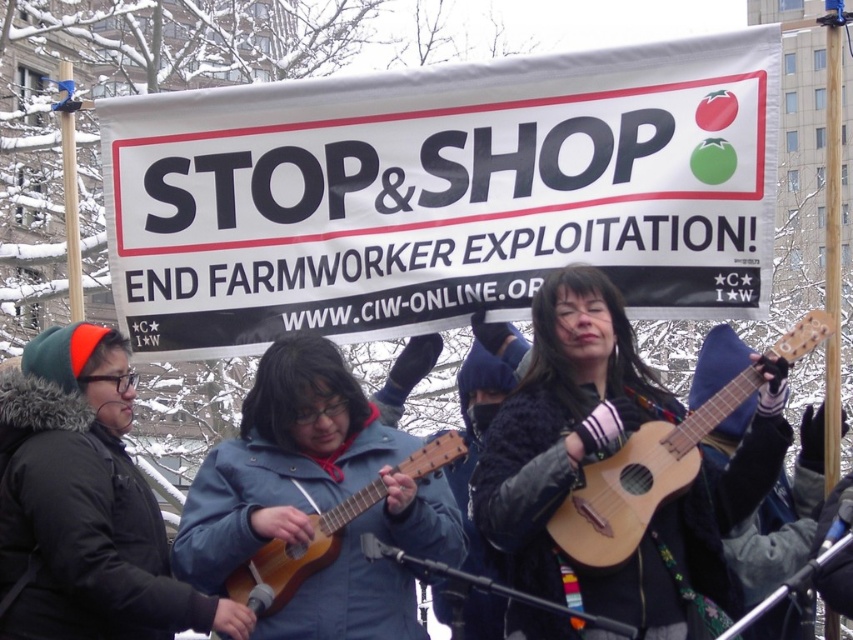
Find the location of a particular element. dark green fur-lined jacket at left is located at coordinates (x=86, y=502).

Is dark green fur-lined jacket at left behind wooden acoustic guitar at center?

No, it is in front of wooden acoustic guitar at center.

Who is more distant from viewer, [112,545] or [376,500]?

Positioned behind is point [376,500].

The width and height of the screenshot is (853, 640). I want to click on dark green fur-lined jacket at left, so [x=86, y=502].

Does light brown wooden guitar at center appear on the right side of wooden acoustic guitar at center?

Indeed, light brown wooden guitar at center is positioned on the right side of wooden acoustic guitar at center.

Does light brown wooden guitar at center appear over wooden acoustic guitar at center?

Yes, light brown wooden guitar at center is above wooden acoustic guitar at center.

Describe the element at coordinates (639, 480) in the screenshot. I see `light brown wooden guitar at center` at that location.

Find the location of a particular element. light brown wooden guitar at center is located at coordinates (639, 480).

From the picture: Which of these two, dark green fur-lined jacket at left or light brown wooden guitar at center, stands taller?

With more height is dark green fur-lined jacket at left.

Describe the element at coordinates (86, 502) in the screenshot. I see `dark green fur-lined jacket at left` at that location.

Where is `dark green fur-lined jacket at left`? dark green fur-lined jacket at left is located at coordinates click(x=86, y=502).